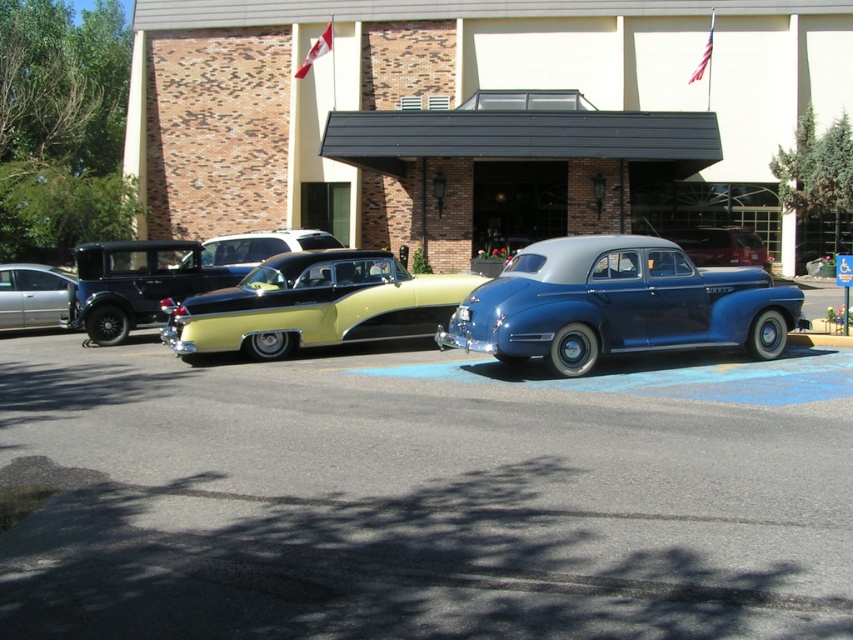
Which of these two, yellow glossy car at center or silver metallic sedan at left, stands taller?

yellow glossy car at center is taller.

How much distance is there between yellow glossy car at center and silver metallic sedan at left?

The distance of yellow glossy car at center from silver metallic sedan at left is 7.00 meters.

The height and width of the screenshot is (640, 853). What do you see at coordinates (315, 305) in the screenshot?
I see `yellow glossy car at center` at bounding box center [315, 305].

At what (x,y) coordinates should I click in order to perform the action: click on yellow glossy car at center. Please return your answer as a coordinate pair (x, y). Image resolution: width=853 pixels, height=640 pixels. Looking at the image, I should click on (315, 305).

Can you confirm if smooth asphalt parking lot at center is thinner than glossy blue sedan at center?

No, smooth asphalt parking lot at center is not thinner than glossy blue sedan at center.

Does point (374, 499) lie behind point (718, 282)?

No.

Image resolution: width=853 pixels, height=640 pixels. In order to click on smooth asphalt parking lot at center in this screenshot , I will do `click(407, 504)`.

How far apart are glossy blue sedan at center and shiny blue sedan at center?

A distance of 12.53 meters exists between glossy blue sedan at center and shiny blue sedan at center.

Is point (756, 276) behind point (706, 241)?

No, it is in front of (706, 241).

The image size is (853, 640). I want to click on glossy blue sedan at center, so click(x=618, y=305).